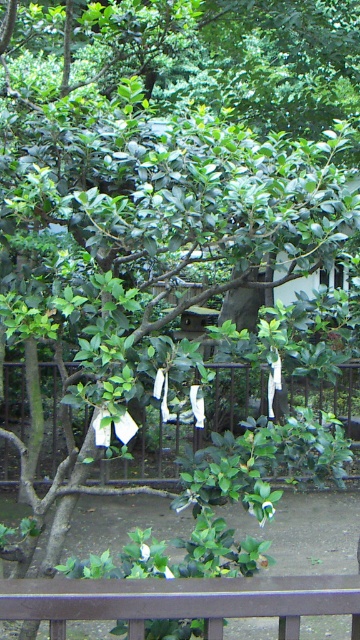
Consider the image. You are standing in the garden and want to place a small offering between the two points, point [303,403] and point [302,586]. Which point is closer to you so you can place the offering there first?

Point [303,403] is closer to you than point [302,586], so you should place the offering there first.

Looking at this image, you are a gardener who needs to install a new sprinkler system between the black metal fence at center and the metallic gray fence at bottom. The sprinkler requires a minimum of 3 meters of space to function properly. Based on the scene, can you determine if there is enough space between the two fences for the sprinkler system?

The distance between the black metal fence at center and the metallic gray fence at bottom is 4.07 meters, which is more than the required 3 meters. Therefore, there is sufficient space to install the sprinkler system between them.

You are planning to install a new fence in your garden. You have two options from the image, the black metal fence at center and the metallic gray fence at bottom. Which one would you choose if you want a larger fence for better privacy?

The black metal fence at center is bigger than the metallic gray fence at bottom, so it would be the better choice for a larger fence and better privacy.